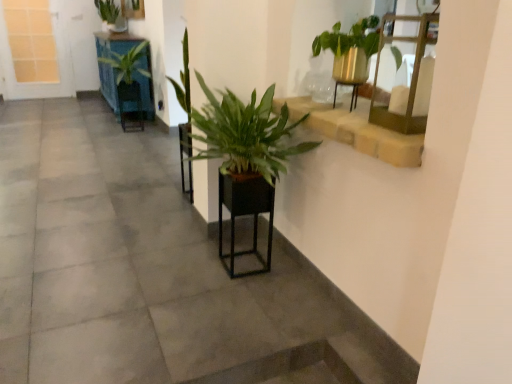
Where is `free spot above smooth concrete at center (from a real-world perspective)`? This screenshot has height=384, width=512. free spot above smooth concrete at center (from a real-world perspective) is located at coordinates (106, 210).